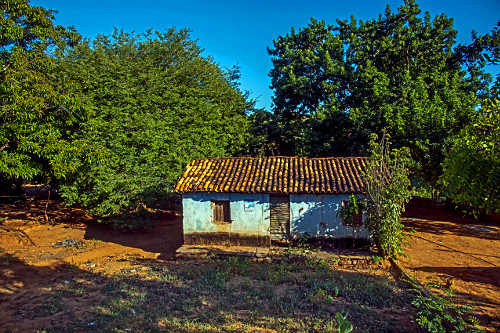
This screenshot has height=333, width=500. Identify the location of windows. (353, 217), (217, 211).